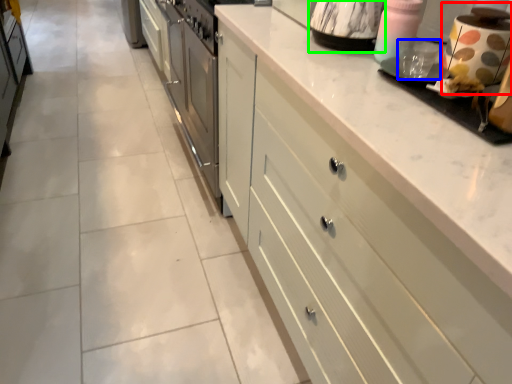
Question: Based on their relative distances, which object is nearer to appliance (highlighted by a red box)? Choose from appliance (highlighted by a blue box) and appliance (highlighted by a green box).

Choices:
 (A) appliance
 (B) appliance

Answer: (A)